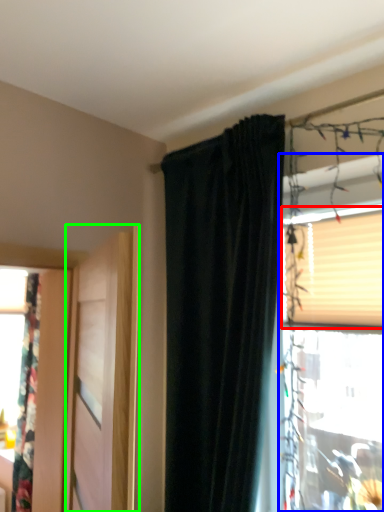
Question: Which object is the farthest from blind (highlighted by a red box)? Choose among these: window (highlighted by a blue box) or door (highlighted by a green box).

Choices:
 (A) window
 (B) door

Answer: (B)